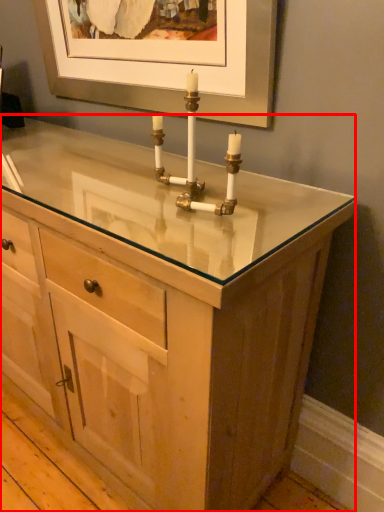
Question: From the image's perspective, considering the relative positions of chest of drawers (annotated by the red box) and candle holder in the image provided, where is chest of drawers (annotated by the red box) located with respect to the staircase?

Choices:
 (A) below
 (B) above

Answer: (A)